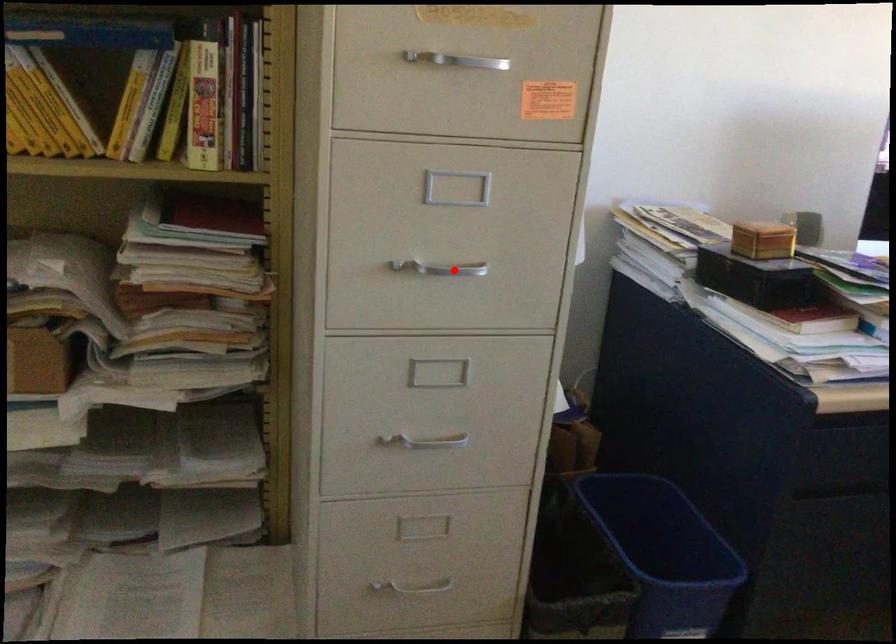
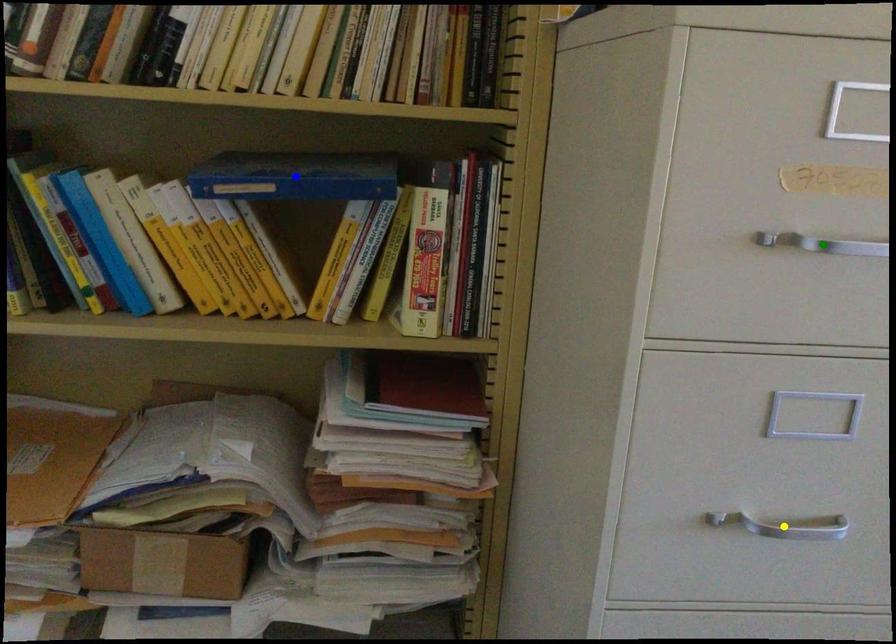
Question: I am providing you with two images of the same scene from different viewpoints. A red point is marked on the first image. You are given multiple points on the second image. Which point in image 2 is actually the same real-world point as the red point in image 1?

Choices:
 (A) yellow point
 (B) green point
 (C) blue point

Answer: (A)